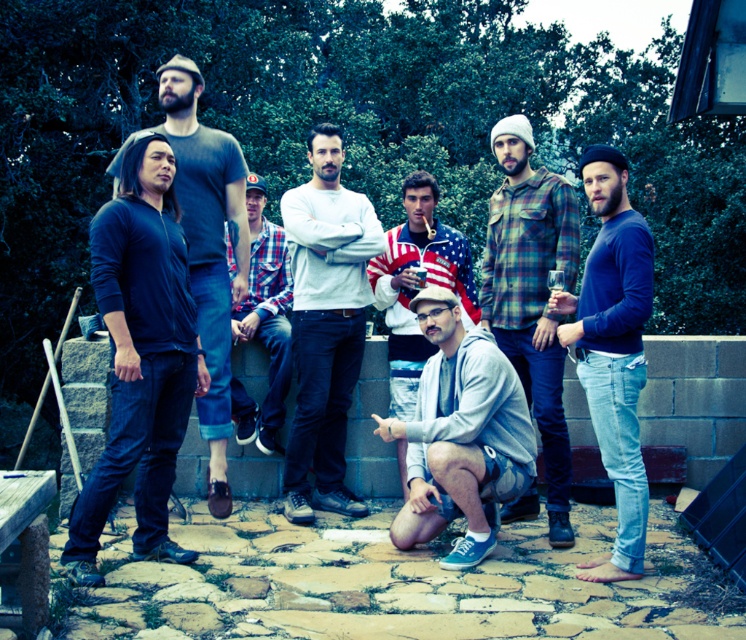
You are a photographer trying to capture a group photo of the dark blue sweater at left and the plaid flannel shirt at center. The minimum distance your camera can focus on two subjects clearly is 2 meters. Will you be able to take a clear photo of both subjects at the same time?

The dark blue sweater at left and plaid flannel shirt at center are 2.57 meters apart from each other. Since the minimum focusing distance required is 2 meters and the actual distance is greater, the camera can focus clearly on both subjects simultaneously.